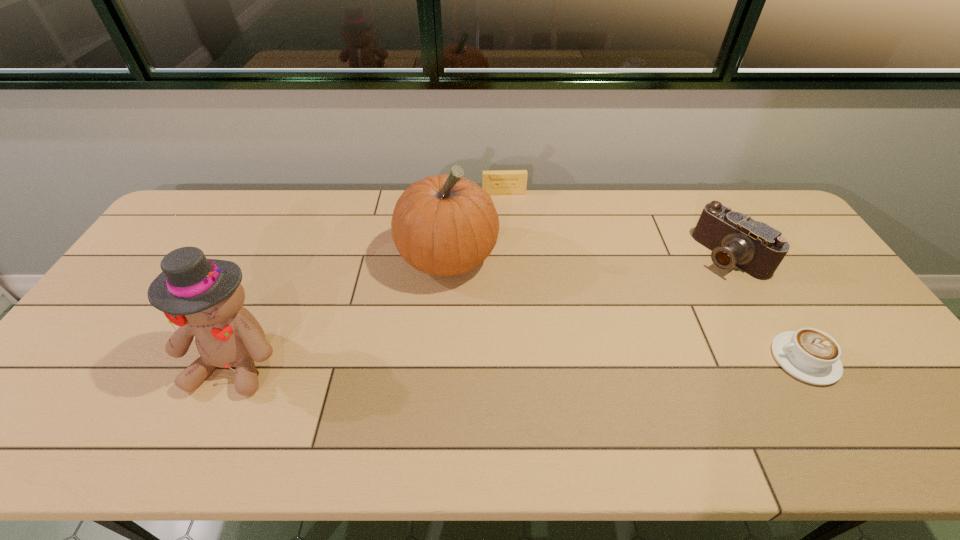
At what (x,y) coordinates should I click in order to perform the action: click on free space located on the stem of the pumpkin. Please return your answer as a coordinate pair (x, y). The width and height of the screenshot is (960, 540). Looking at the image, I should click on (516, 353).

Identify the location of free space located on the stem of the pumpkin. Image resolution: width=960 pixels, height=540 pixels. (515, 350).

In order to click on free space located at the front of the second shortest object with spools in this screenshot , I will do `click(508, 220)`.

Identify the location of free region located at the front of the second shortest object with spools. (513, 256).

Find the location of a particular element. The width and height of the screenshot is (960, 540). vacant position located at the front of the second shortest object with spools is located at coordinates (508, 222).

Find the location of `vacant area situated 0.200m on the front-facing side of the camera`. vacant area situated 0.200m on the front-facing side of the camera is located at coordinates (669, 298).

This screenshot has width=960, height=540. In order to click on vacant space situated on the front-facing side of the camera in this screenshot , I will do [x=676, y=293].

The height and width of the screenshot is (540, 960). I want to click on vacant area situated 0.220m on the front-facing side of the camera, so click(664, 301).

Identify the location of pumpkin present at the far edge. This screenshot has height=540, width=960. (444, 225).

Where is `videotape located at the far edge`? The height and width of the screenshot is (540, 960). videotape located at the far edge is located at coordinates (501, 182).